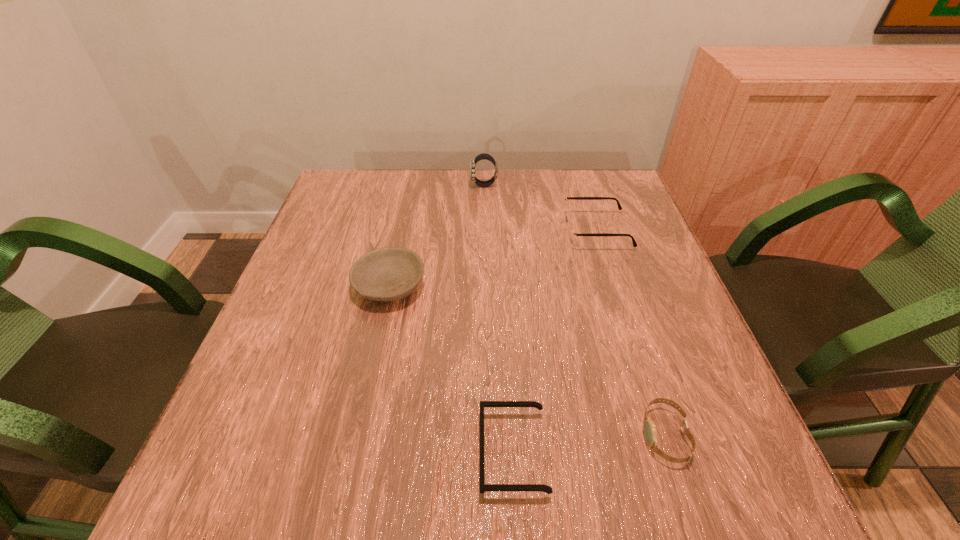
The height and width of the screenshot is (540, 960). I want to click on vacant space situated on the face of the farther watch, so click(401, 185).

This screenshot has height=540, width=960. What are the coordinates of `free space located 0.190m at the hinge ends of the fourth nearest object` in the screenshot? It's located at (490, 231).

This screenshot has width=960, height=540. I want to click on free space located at the hinge ends of the fourth nearest object, so click(513, 231).

This screenshot has width=960, height=540. I want to click on vacant space situated at the hinge ends of the fourth nearest object, so click(497, 231).

At what (x,y) coordinates should I click in order to perform the action: click on vacant region located on the front of the bowl. Please return your answer as a coordinate pair (x, y). Image resolution: width=960 pixels, height=540 pixels. Looking at the image, I should click on (370, 378).

Where is `vacant space located 0.180m on the face of the shorter watch`? The height and width of the screenshot is (540, 960). vacant space located 0.180m on the face of the shorter watch is located at coordinates (532, 435).

Where is `vacant space located on the face of the shorter watch`? This screenshot has width=960, height=540. vacant space located on the face of the shorter watch is located at coordinates (470, 435).

The image size is (960, 540). Find the location of `vacant area situated on the face of the shorter watch`. vacant area situated on the face of the shorter watch is located at coordinates (612, 435).

At what (x,y) coordinates should I click in order to perform the action: click on blank space located 0.080m on the front-facing side of the shortest object. Please return your answer as a coordinate pair (x, y). Image resolution: width=960 pixels, height=540 pixels. Looking at the image, I should click on (429, 453).

Where is `free space located 0.230m on the front-facing side of the shortest object`? The height and width of the screenshot is (540, 960). free space located 0.230m on the front-facing side of the shortest object is located at coordinates (334, 453).